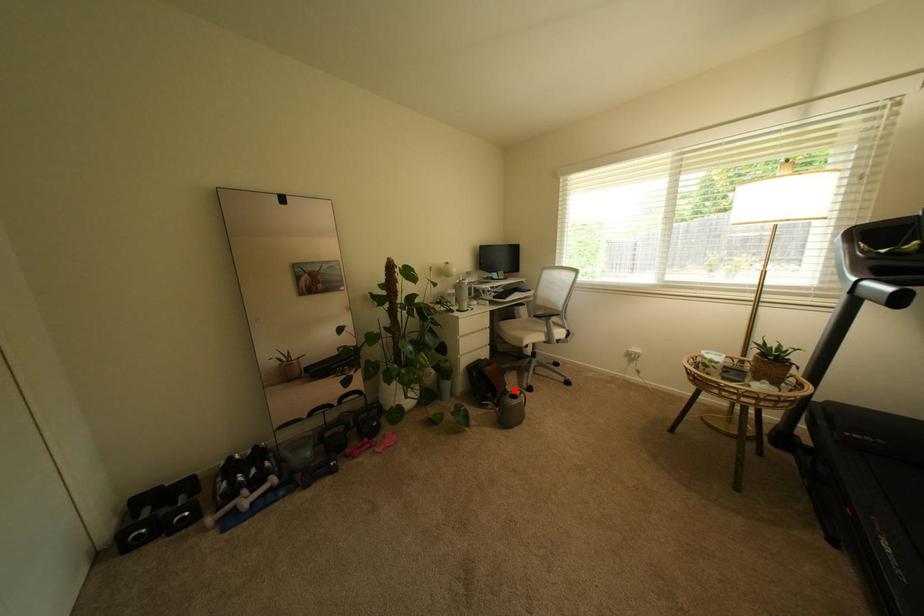
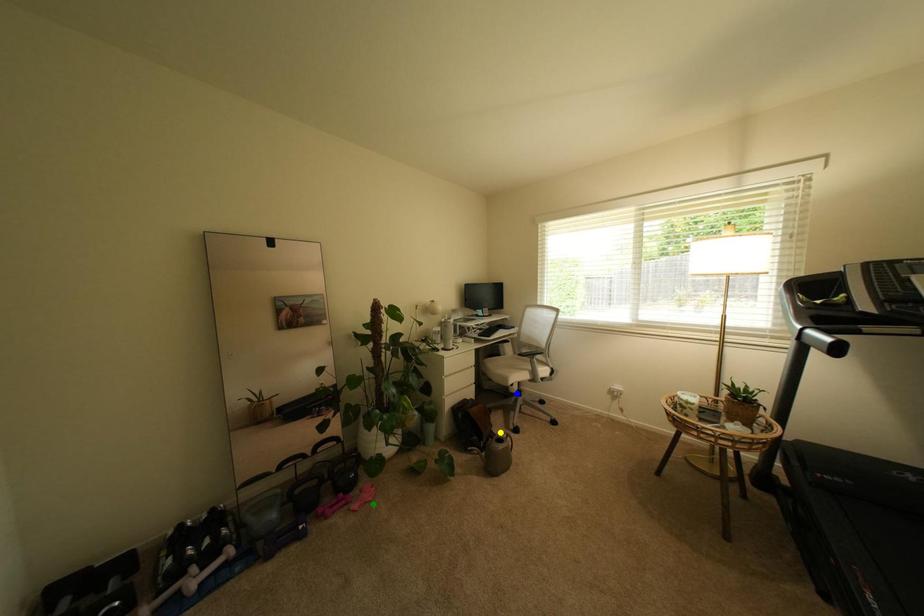
Question: I am providing you with two images of the same scene from different viewpoints. A red point is marked on the first image. You are given multiple points on the second image. Which mark in image 2 goes with the point in image 1?

Choices:
 (A) green point
 (B) yellow point
 (C) blue point

Answer: (B)